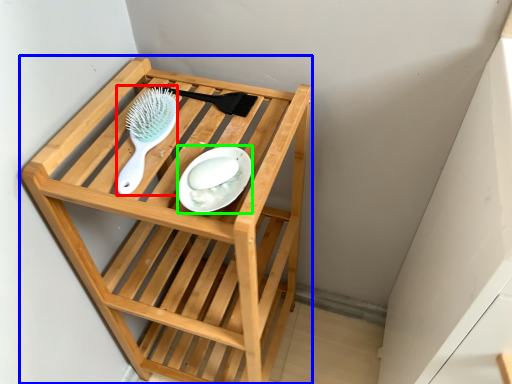
Question: Considering the real-world distances, which object is farthest from brush (highlighted by a red box)? furniture (highlighted by a blue box) or plate (highlighted by a green box)?

Choices:
 (A) furniture
 (B) plate

Answer: (A)